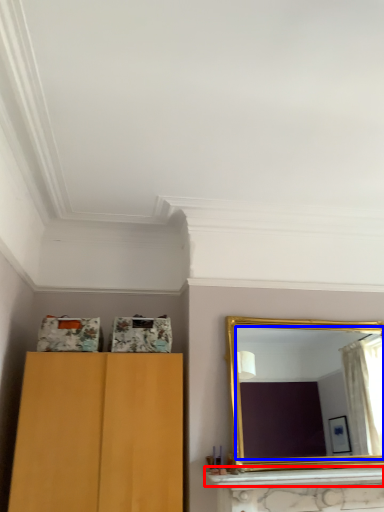
Question: Which object appears farthest to the camera in this image, mantle (highlighted by a red box) or mirror (highlighted by a blue box)?

Choices:
 (A) mantle
 (B) mirror

Answer: (B)